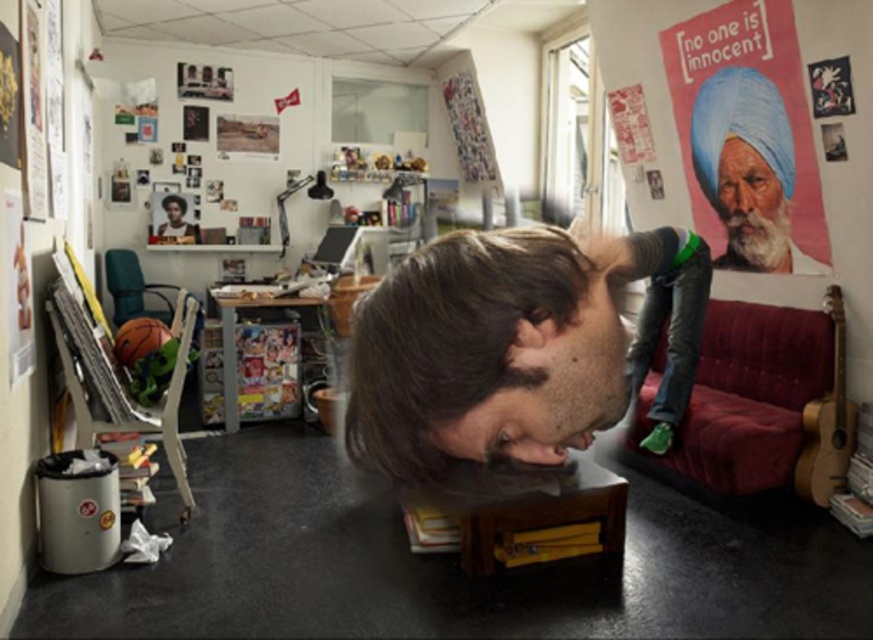
Looking at the man in the image, which part has a smaller width between his brown matte hair at center and his white beard at upper right?

The brown matte hair at center has a smaller width compared to the white beard at upper right.

You are standing in the workspace and want to place a small object on the point at coordinates point (390, 476). However, there is another point at point (736, 186). Which point is closer to you?

Point (390, 476) is in front of point (736, 186), so placing the object there would mean it is closer to you.

You are an interior designer analyzing the placement of items in the workspace. Which object is positioned to the left when comparing the matte plastic poster at upper right and the white fluffy beard at upper right?

The matte plastic poster at upper right is positioned to the left of the white fluffy beard at upper right.